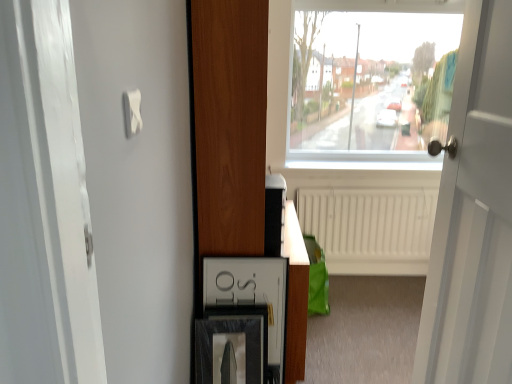
Question: Is matte black picture frame at lower center not within matte black medicine cabinet at lower center?

Choices:
 (A) no
 (B) yes

Answer: (B)

Question: Considering the relative positions of matte black picture frame at lower center and matte black medicine cabinet at lower center in the image provided, is matte black picture frame at lower center to the right of matte black medicine cabinet at lower center from the viewer's perspective?

Choices:
 (A) yes
 (B) no

Answer: (B)

Question: From the image's perspective, is matte black picture frame at lower center beneath matte black medicine cabinet at lower center?

Choices:
 (A) no
 (B) yes

Answer: (B)

Question: Is matte black picture frame at lower center far away from matte black medicine cabinet at lower center?

Choices:
 (A) yes
 (B) no

Answer: (B)

Question: From a real-world perspective, is matte black picture frame at lower center positioned over matte black medicine cabinet at lower center based on gravity?

Choices:
 (A) no
 (B) yes

Answer: (A)

Question: Is matte black picture frame at lower center positioned in front of matte black medicine cabinet at lower center?

Choices:
 (A) no
 (B) yes

Answer: (B)

Question: Is white glossy dresser at center closer to camera compared to white matte radiator at center?

Choices:
 (A) no
 (B) yes

Answer: (B)

Question: From a real-world perspective, does white glossy dresser at center stand above white matte radiator at center?

Choices:
 (A) yes
 (B) no

Answer: (A)

Question: Considering the relative sizes of white glossy dresser at center and white matte radiator at center in the image provided, is white glossy dresser at center smaller than white matte radiator at center?

Choices:
 (A) yes
 (B) no

Answer: (B)

Question: From the image's perspective, is white glossy dresser at center located beneath white matte radiator at center?

Choices:
 (A) no
 (B) yes

Answer: (A)

Question: Can you confirm if white glossy dresser at center is taller than white matte radiator at center?

Choices:
 (A) yes
 (B) no

Answer: (A)

Question: Considering the relative sizes of white glossy dresser at center and white matte radiator at center in the image provided, is white glossy dresser at center bigger than white matte radiator at center?

Choices:
 (A) no
 (B) yes

Answer: (B)

Question: Could matte black medicine cabinet at lower center be considered to be inside white wooden door at right?

Choices:
 (A) no
 (B) yes

Answer: (A)